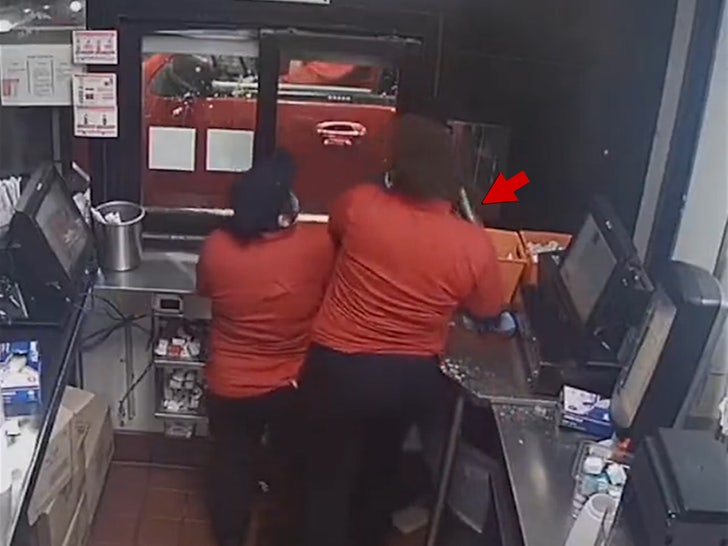
Where is `wall`? wall is located at coordinates click(x=609, y=146).